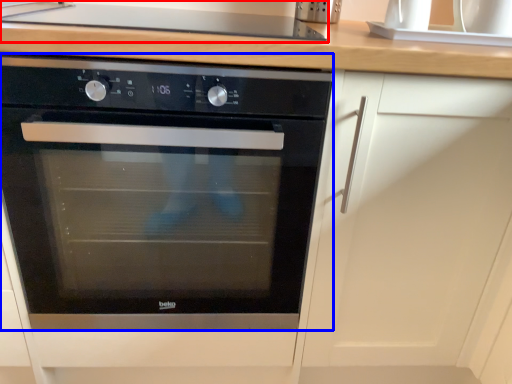
Question: Among these objects, which one is farthest to the camera, gas stove (highlighted by a red box) or oven (highlighted by a blue box)?

Choices:
 (A) gas stove
 (B) oven

Answer: (A)